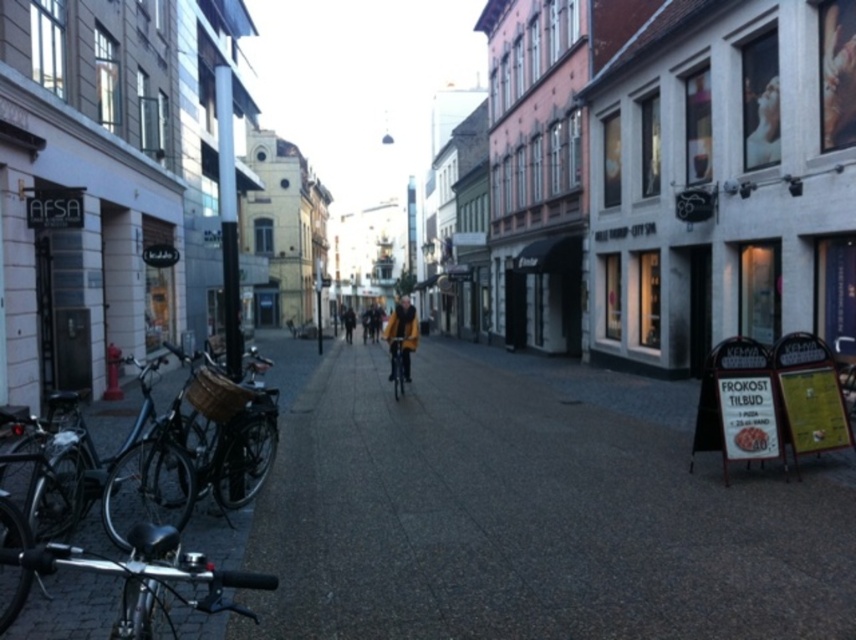
Question: Is yellow wool coat at center in front of shiny metallic bicycle at center?

Choices:
 (A) no
 (B) yes

Answer: (A)

Question: Among these objects, which one is farthest from the camera?

Choices:
 (A) smooth concrete pavement at center
 (B) yellow coat at center
 (C) shiny metallic bicycle at center

Answer: (B)

Question: Which object is positioned farthest from the yellow coat at center?

Choices:
 (A) shiny metallic bicycle at center
 (B) smooth concrete pavement at center

Answer: (B)

Question: Does smooth concrete pavement at center have a lesser width compared to yellow coat at center?

Choices:
 (A) no
 (B) yes

Answer: (B)

Question: Does smooth concrete pavement at center appear under yellow wool coat at center?

Choices:
 (A) no
 (B) yes

Answer: (B)

Question: Which object is positioned farthest from the shiny metallic bicycle at center?

Choices:
 (A) yellow coat at center
 (B) shiny black bicycle at left
 (C) yellow wool coat at center
 (D) smooth concrete pavement at center

Answer: (A)